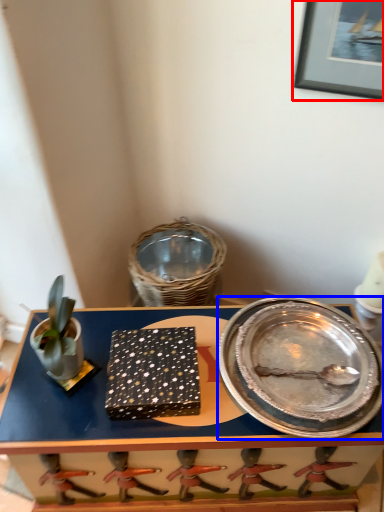
Question: Which of the following is the closest to the observer, picture frame (highlighted by a red box) or platter (highlighted by a blue box)?

Choices:
 (A) picture frame
 (B) platter

Answer: (A)